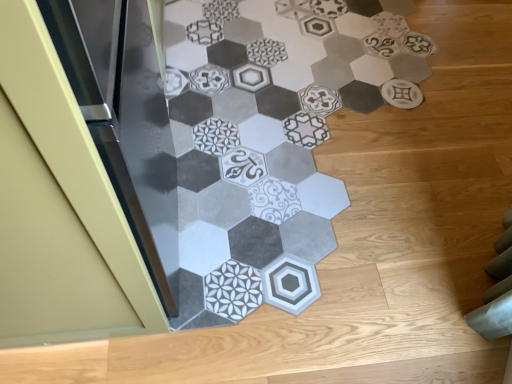
The height and width of the screenshot is (384, 512). Find the location of `matte gray hexagon at center`. matte gray hexagon at center is located at coordinates (270, 135).

This screenshot has width=512, height=384. What do you see at coordinates (270, 135) in the screenshot?
I see `matte gray hexagon at center` at bounding box center [270, 135].

Where is `matte gray hexagon at center`? matte gray hexagon at center is located at coordinates pyautogui.click(x=270, y=135).